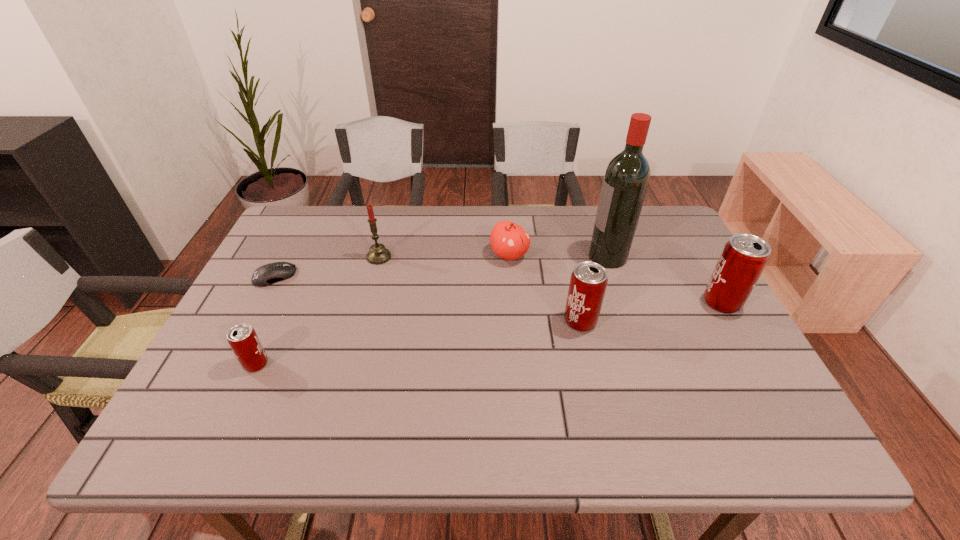
Find the location of a particular element. This screenshot has height=540, width=960. blank space at the right edge of the desktop is located at coordinates (694, 341).

This screenshot has width=960, height=540. In order to click on vacant space at the far left corner of the desktop in this screenshot , I will do `click(322, 224)`.

Image resolution: width=960 pixels, height=540 pixels. I want to click on vacant area at the near left corner, so click(202, 402).

The height and width of the screenshot is (540, 960). In the image, there is a desktop. Identify the location of vacant region at the far right corner. (651, 245).

I want to click on blank space at the near right corner, so click(759, 407).

This screenshot has width=960, height=540. I want to click on empty space between the shortest beer can and the rightmost beer can, so click(x=489, y=333).

Where is `free space between the candle and the sixth object from left to right`? The height and width of the screenshot is (540, 960). free space between the candle and the sixth object from left to right is located at coordinates (493, 256).

Locate an element on the screen. free area in between the fourth object from left to right and the second object from right to left is located at coordinates (559, 256).

Image resolution: width=960 pixels, height=540 pixels. I want to click on empty space between the rightmost beer can and the tallest object, so click(x=664, y=280).

I want to click on vacant space in between the rightmost object and the tallest object, so click(x=664, y=280).